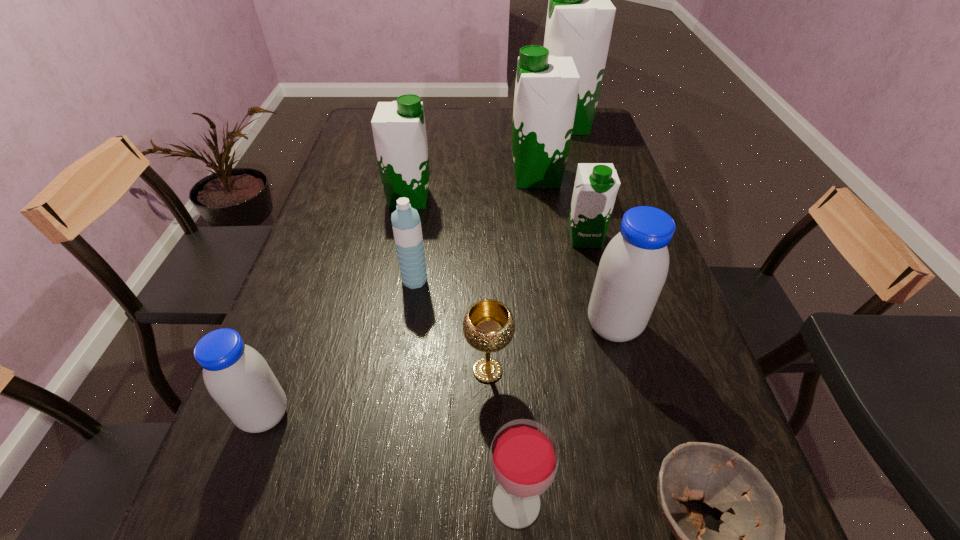
At what (x,y) coordinates should I click in order to perform the action: click on the biggest green soya milk. Please return your answer as a coordinate pair (x, y). Looking at the image, I should click on (x=580, y=16).

The width and height of the screenshot is (960, 540). In order to click on the farthest soya milk in this screenshot , I will do `click(580, 16)`.

You are a GUI agent. You are given a task and a screenshot of the screen. Output one action in this format:
    pyautogui.click(x=<x>, y=<y>)
    Task: Click on the third smallest green soya milk
    The image size is (960, 540).
    Given the screenshot: What is the action you would take?
    pyautogui.click(x=546, y=90)

Identify the location of the second tallest soya milk. (546, 90).

Where is `the fifth soya milk from right to left`? the fifth soya milk from right to left is located at coordinates (399, 131).

Locate an element on the screen. the leftmost green soya milk is located at coordinates (399, 131).

Where is `the bigger blue soya milk`? The image size is (960, 540). the bigger blue soya milk is located at coordinates (632, 271).

The height and width of the screenshot is (540, 960). Find the location of `the right blue soya milk`. the right blue soya milk is located at coordinates (632, 271).

The width and height of the screenshot is (960, 540). What are the coordinates of `blue water bottle` in the screenshot? It's located at (406, 224).

At what (x,y) coordinates should I click in order to perform the action: click on the sixth nearest object. Please return your answer as a coordinate pair (x, y). Image resolution: width=960 pixels, height=540 pixels. Looking at the image, I should click on (406, 224).